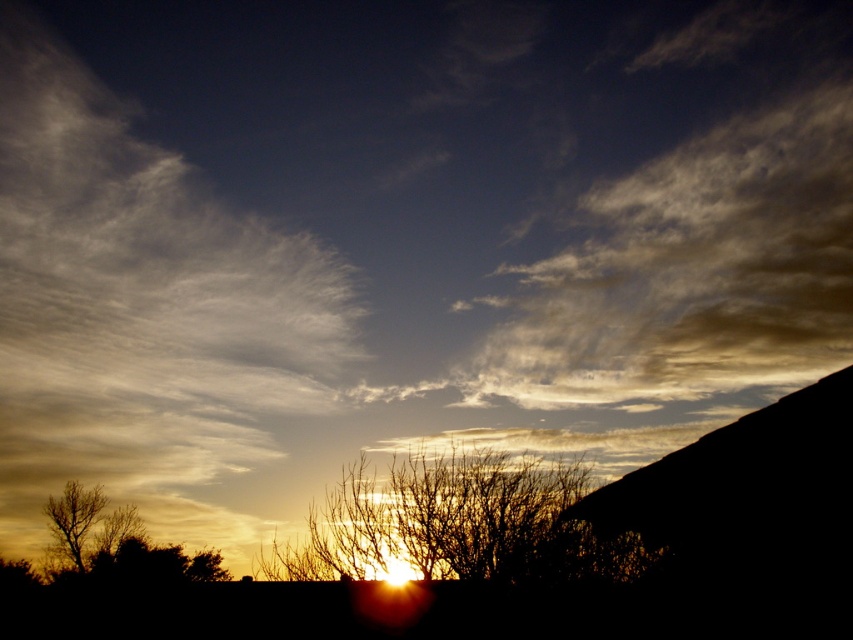
Is silhouette bare tree at center thinner than brown matte tree at lower left?

Yes, silhouette bare tree at center is thinner than brown matte tree at lower left.

Does point (541, 458) come farther from viewer compared to point (125, 532)?

No, it is in front of (125, 532).

Between point (267, 561) and point (90, 497), which one is positioned in front?

Point (267, 561)

Where is `silhouette bare tree at center`? The image size is (853, 640). silhouette bare tree at center is located at coordinates point(457,524).